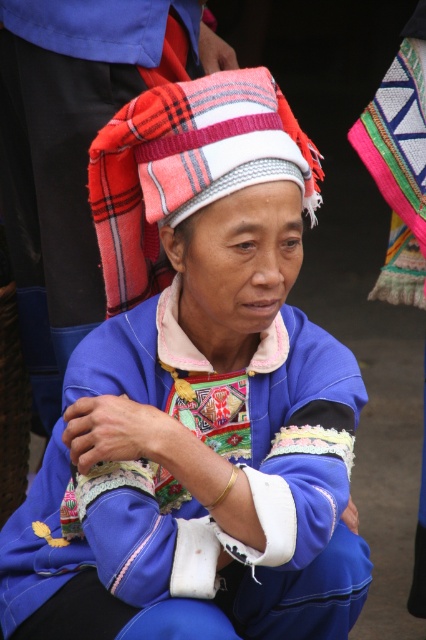
Consider the image. You are an anthropologist studying traditional clothing. You notice the matte blue fabric at center and the knitted woolen hat at center in the image. Which object is positioned to the left?

The matte blue fabric at center is to the left of the knitted woolen hat at center.

You are an anthropologist studying traditional clothing. You observe the person in the scene wearing a matte blue fabric at center and a knitted woolen hat at center. Which of these items is taller?

The matte blue fabric at center is much taller than the knitted woolen hat at center.

You are an anthropologist studying traditional clothing. You observe the matte blue fabric at center and the knitted woolen hat at center in the image. Which object occupies a greater area in the scene?

The matte blue fabric at center has a larger size compared to the knitted woolen hat at center, so the matte blue fabric at center occupies a greater area in the scene.